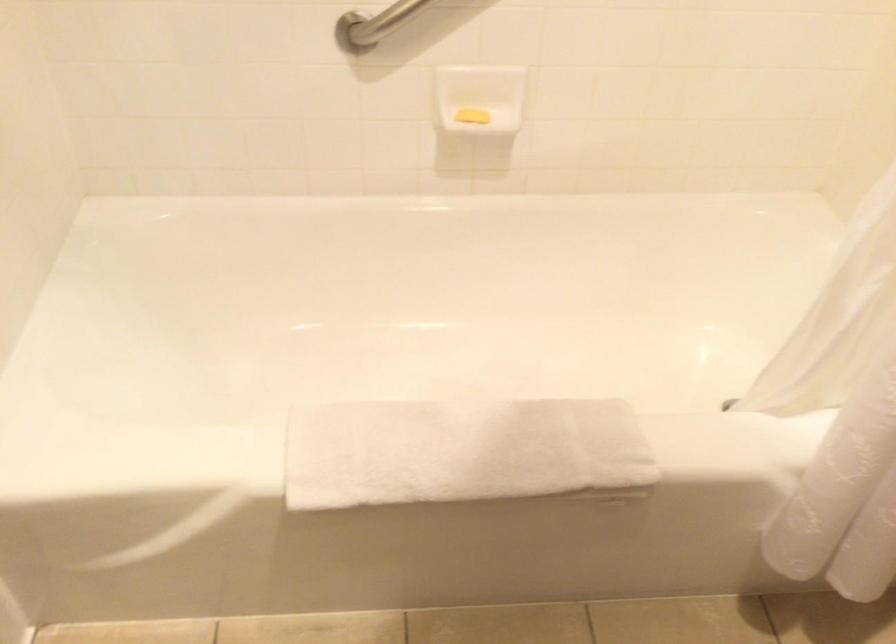
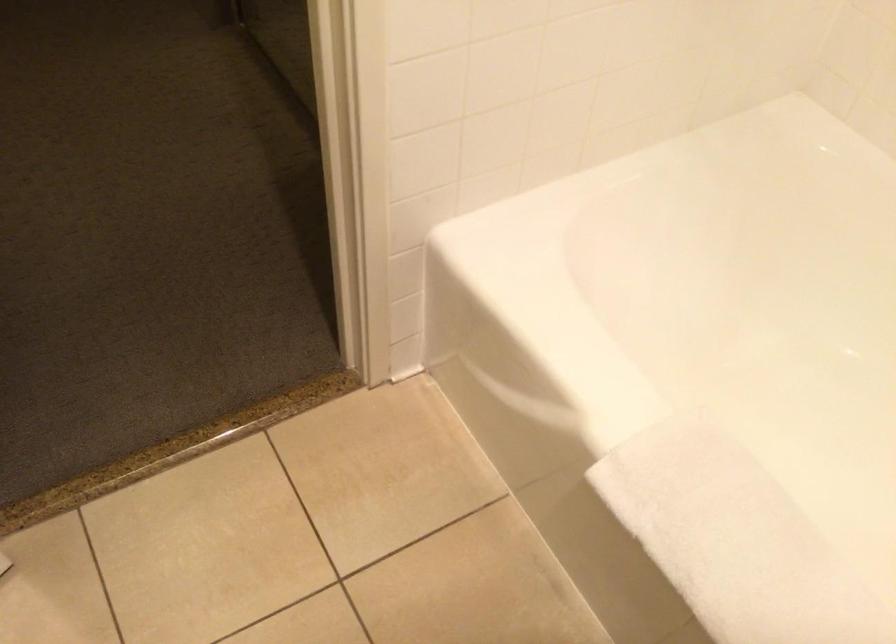
The images are taken continuously from a first-person perspective. In which direction is your viewpoint rotating?

The camera rotated toward left-down.